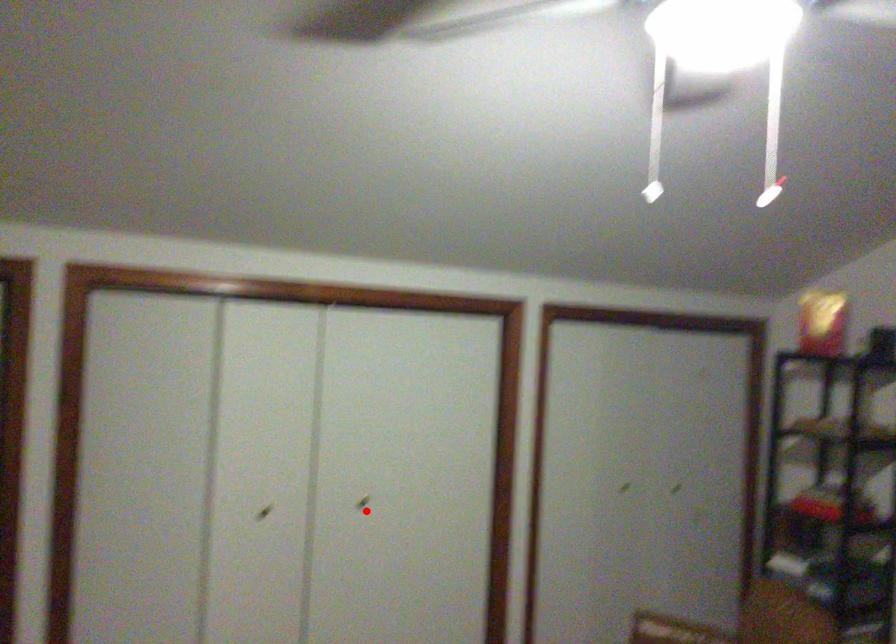
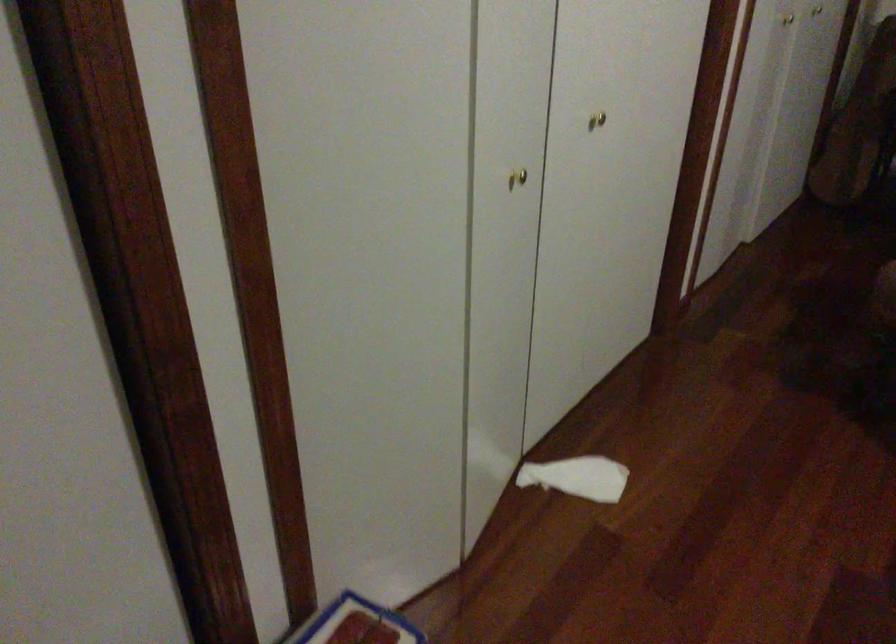
Where in the second image is the point corresponding to the highlighted location from the first image?

(597, 120)